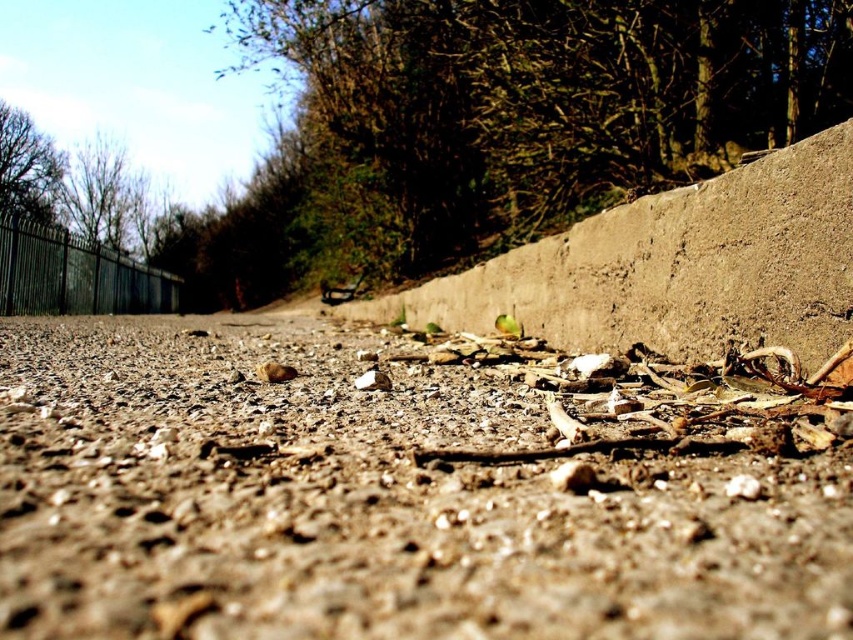
Which is more to the left, brown gravel at center or black metal fence at left?

Positioned to the left is black metal fence at left.

Looking at this image, can you confirm if brown gravel at center is smaller than black metal fence at left?

Yes, brown gravel at center is smaller than black metal fence at left.

This screenshot has width=853, height=640. In order to click on brown gravel at center in this screenshot , I will do `click(370, 502)`.

Does point (576, 346) come behind point (85, 296)?

No, it is not.

Can you confirm if gray concrete wall at center is positioned to the left of black metal fence at left?

In fact, gray concrete wall at center is to the right of black metal fence at left.

Which is behind, point (815, 209) or point (62, 243)?

The point (62, 243) is behind.

In order to click on gray concrete wall at center in this screenshot , I will do `click(675, 268)`.

Is brown gravel at center shorter than gray concrete wall at center?

Yes, brown gravel at center is shorter than gray concrete wall at center.

Can you confirm if brown gravel at center is taller than gray concrete wall at center?

Incorrect, brown gravel at center's height is not larger of gray concrete wall at center's.

Image resolution: width=853 pixels, height=640 pixels. I want to click on brown gravel at center, so click(x=370, y=502).